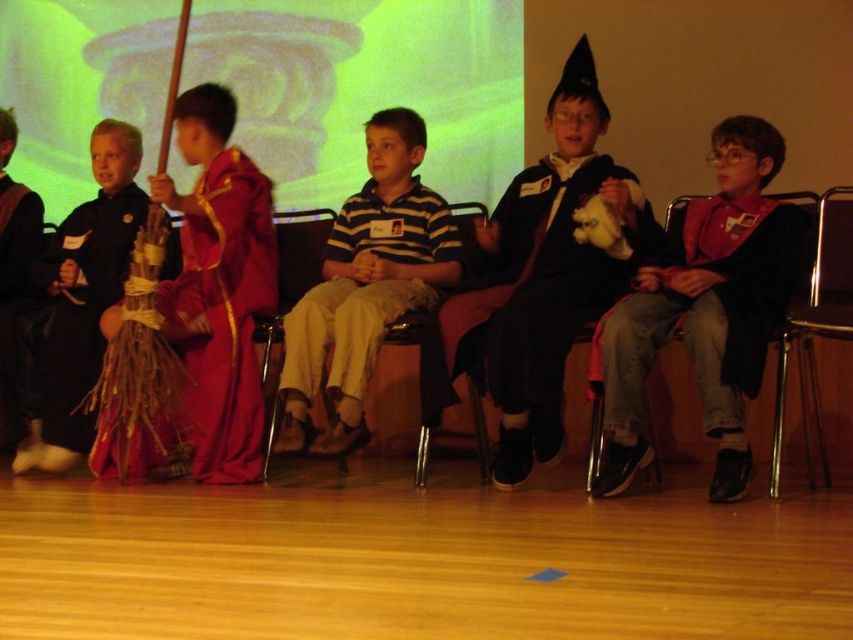
Can you confirm if black matte wizard hat at center is positioned above matte black jacket at right?

Indeed, black matte wizard hat at center is positioned over matte black jacket at right.

Does black matte wizard hat at center lie in front of matte black jacket at right?

No, it is behind matte black jacket at right.

The image size is (853, 640). Find the location of `black matte wizard hat at center`. black matte wizard hat at center is located at coordinates (544, 275).

Locate an element on the screen. This screenshot has width=853, height=640. matte black jacket at right is located at coordinates (706, 308).

Between point (740, 124) and point (817, 310), which one is positioned behind?

Point (740, 124)

Where is `matte black jacket at right`? The width and height of the screenshot is (853, 640). matte black jacket at right is located at coordinates (706, 308).

In order to click on matte black jacket at right in this screenshot , I will do pos(706,308).

Is velvet maroon robe at left shorter than metallic silver chair at right?

No, velvet maroon robe at left is not shorter than metallic silver chair at right.

Who is taller, velvet maroon robe at left or metallic silver chair at right?

velvet maroon robe at left is taller.

The width and height of the screenshot is (853, 640). What are the coordinates of `velvet maroon robe at left` in the screenshot? It's located at (212, 332).